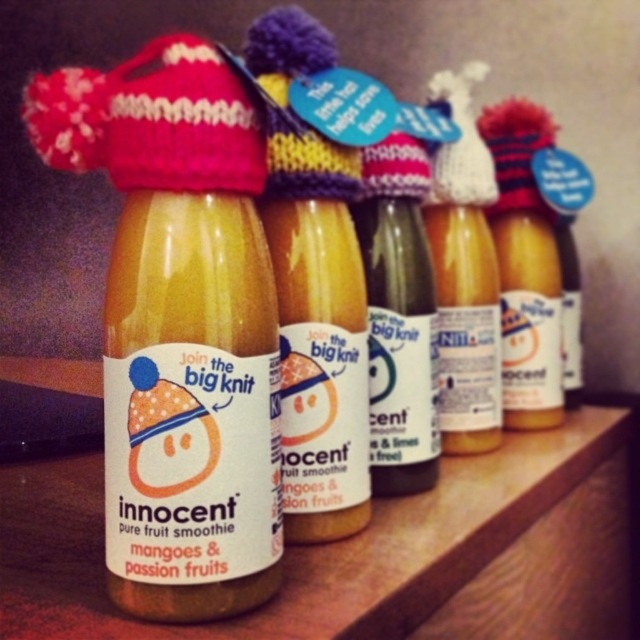
You are organizing a charity event and need to arrange two Innocent smoothie bottles on a table. You have a translucent glass bottle at center and a matte glass bottle at center. According to the image, which bottle should be placed to the left to follow the original arrangement?

The translucent glass bottle at center should be placed to the left of the matte glass bottle at center to maintain the original arrangement as shown in the image.

You are organizing a display for the Join the big knit campaign and have two bottles in front of you. Which one is bigger between the translucent glass bottle at center and the matte glass bottle at center?

The translucent glass bottle at center is larger in size compared to the matte glass bottle at center.